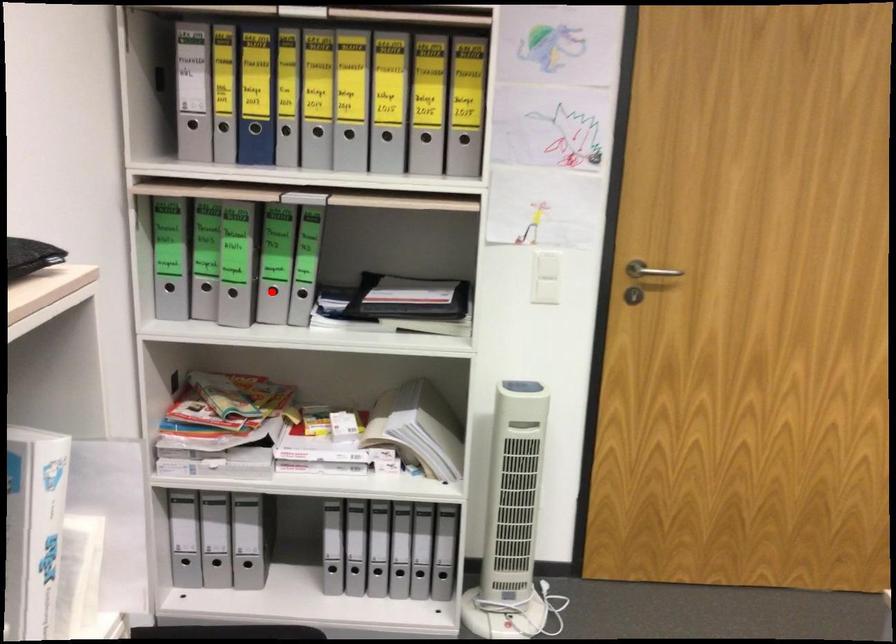
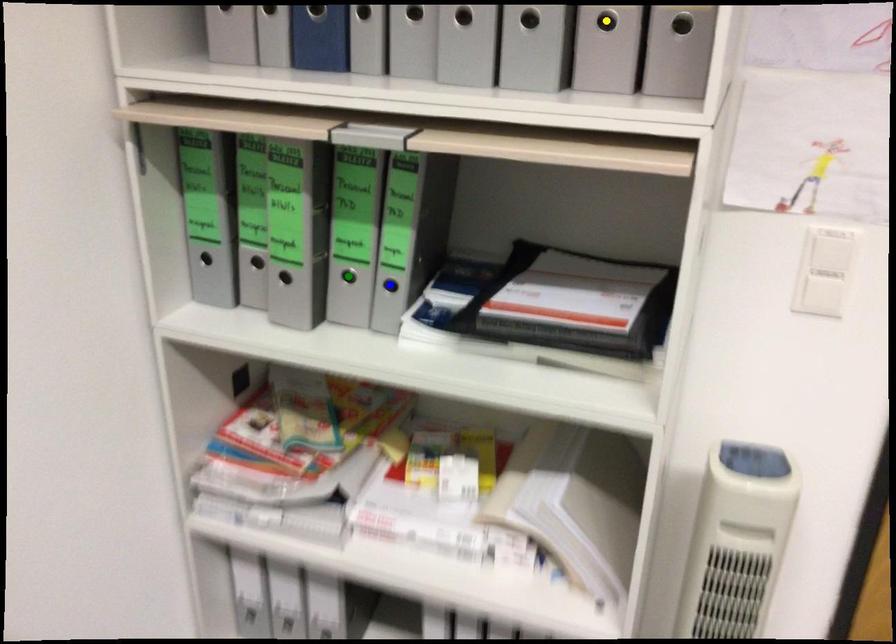
Question: I am providing you with two images of the same scene from different viewpoints. A red point is marked on the first image. You are given multiple points on the second image. Which point in image 2 represents the same 3d spot as the red point in image 1?

Choices:
 (A) green point
 (B) blue point
 (C) yellow point

Answer: (A)